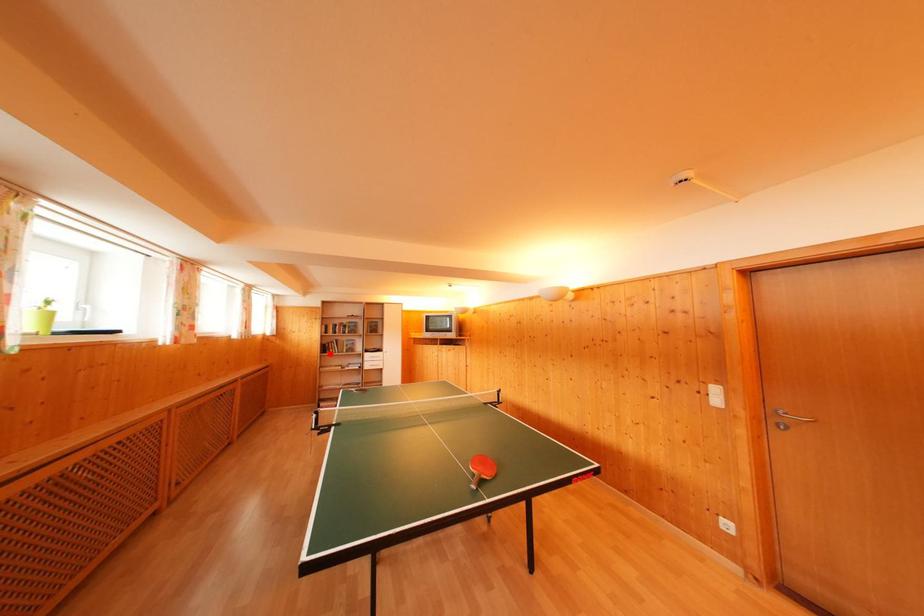
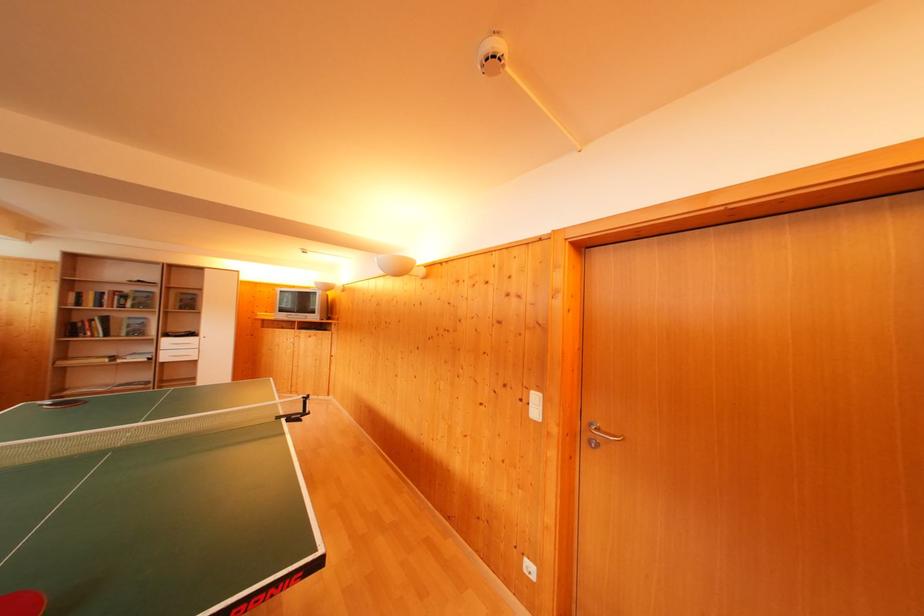
The point at the highlighted location is marked in the first image. Where is the corresponding point in the second image?

(76, 334)